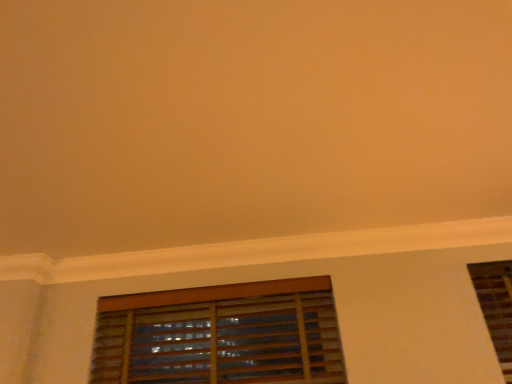
What do you see at coordinates (220, 335) in the screenshot?
I see `wooden blinds at lower center` at bounding box center [220, 335].

Where is `wooden blinds at lower center`? The image size is (512, 384). wooden blinds at lower center is located at coordinates (220, 335).

Measure the distance between wooden blinds at lower center and camera.

wooden blinds at lower center and camera are 5.73 feet apart.

Find the location of `wooden blinds at lower center`. wooden blinds at lower center is located at coordinates (220, 335).